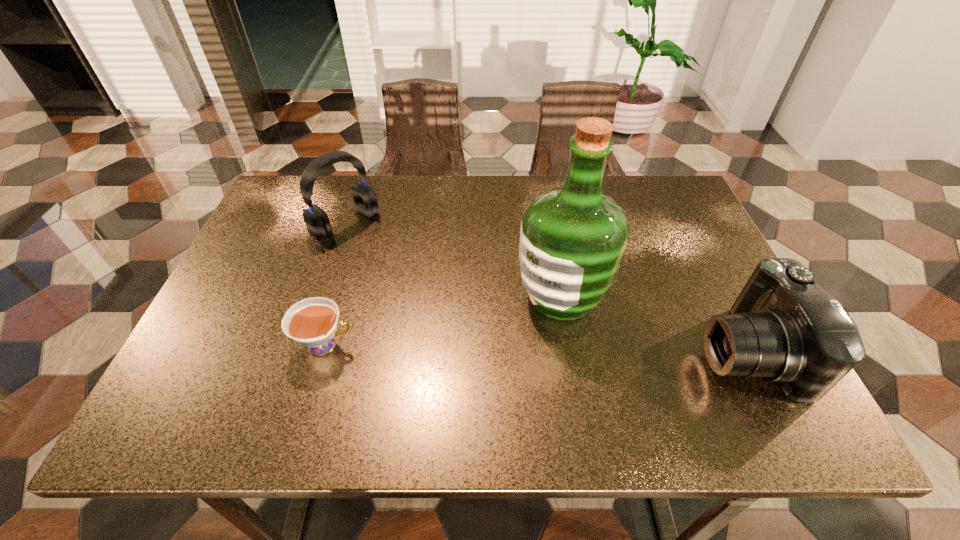
Locate an element on the screen. the shortest object is located at coordinates (312, 322).

At what (x,y) coordinates should I click in order to perform the action: click on the rightmost object. Please return your answer as a coordinate pair (x, y). This screenshot has width=960, height=540. Looking at the image, I should click on (784, 328).

Where is `the third tallest object`? The image size is (960, 540). the third tallest object is located at coordinates (784, 328).

The height and width of the screenshot is (540, 960). Find the location of `headset`. headset is located at coordinates tap(317, 221).

In order to click on the farthest object in this screenshot , I will do `click(317, 221)`.

Where is `liquor`? This screenshot has height=540, width=960. liquor is located at coordinates (x=572, y=239).

I want to click on the second object from right to left, so click(x=572, y=239).

The image size is (960, 540). I want to click on free spot located 0.220m on the side of the teacup with the handle, so click(x=458, y=345).

Identify the location of vacant region located 0.200m on the lens of the camera. The height and width of the screenshot is (540, 960). (606, 350).

The image size is (960, 540). Identify the location of vacant point located on the lens of the camera. (653, 350).